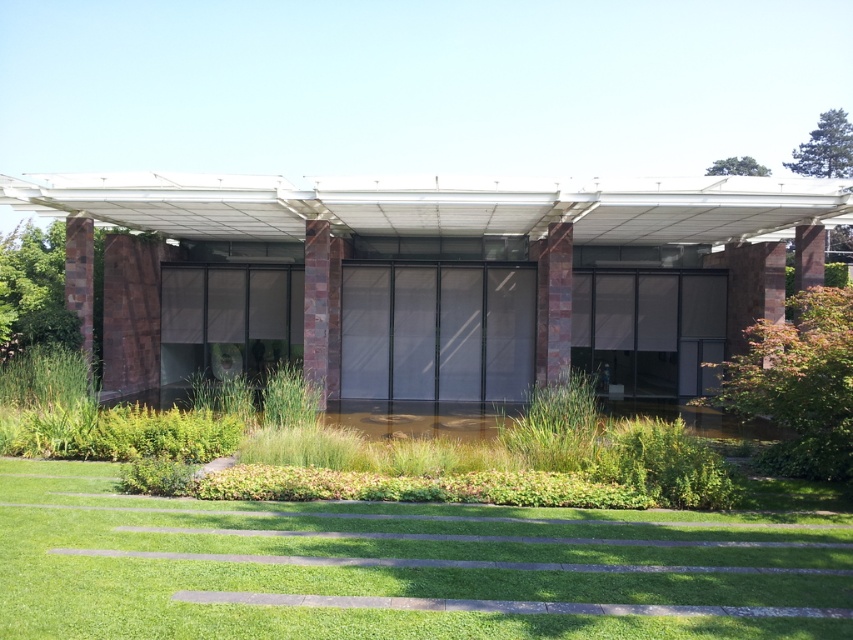
Question: Is matte white pergola at center thinner than green grass at lower center?

Choices:
 (A) yes
 (B) no

Answer: (B)

Question: Does matte white pergola at center have a smaller size compared to green grass at lower center?

Choices:
 (A) no
 (B) yes

Answer: (A)

Question: Is matte white pergola at center positioned in front of green grass at lower center?

Choices:
 (A) no
 (B) yes

Answer: (A)

Question: Which of the following is the closest to the observer?

Choices:
 (A) (445, 317)
 (B) (744, 588)

Answer: (B)

Question: Which of the following is the farthest from the observer?

Choices:
 (A) (583, 576)
 (B) (76, 225)

Answer: (B)

Question: Which object appears closest to the camera in this image?

Choices:
 (A) matte white pergola at center
 (B) green grass at lower center

Answer: (B)